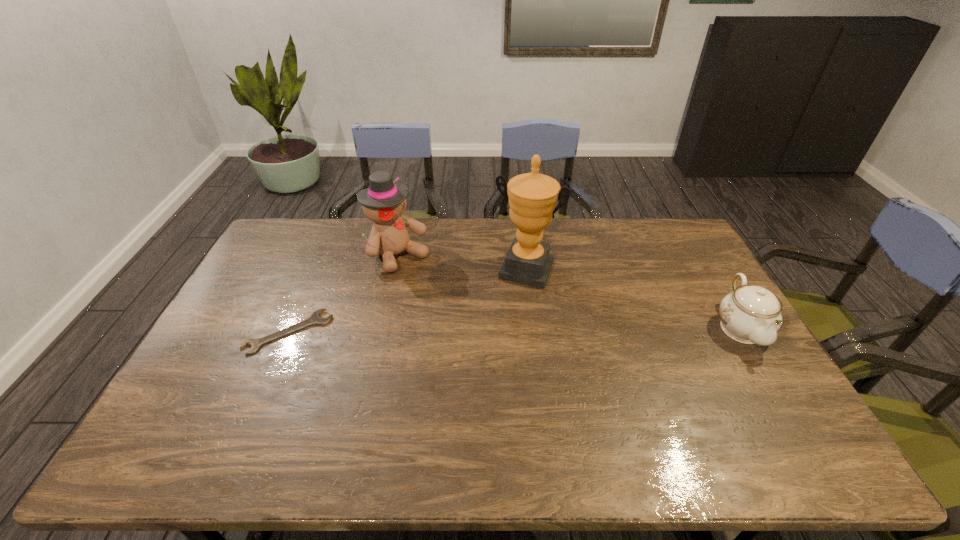
You are a GUI agent. You are given a task and a screenshot of the screen. Output one action in this format:
    pyautogui.click(x=<x>, y=<y>)
    Task: Click on the free area in between the wrench and the award
    This screenshot has height=540, width=960.
    Given the screenshot: What is the action you would take?
    pyautogui.click(x=407, y=301)

Identify the location of free point between the award and the wrench. Image resolution: width=960 pixels, height=540 pixels. (407, 301).

At what (x,y) coordinates should I click in order to perform the action: click on unoccupied position between the award and the chinaware. Please return your answer as a coordinate pair (x, y). The height and width of the screenshot is (540, 960). Looking at the image, I should click on (633, 299).

Find the location of a particular element. empty space between the second shortest object and the award is located at coordinates (633, 299).

Where is `empty location between the tallest object and the second tallest object`? empty location between the tallest object and the second tallest object is located at coordinates (462, 262).

Locate an element on the screen. object that is the nearest to the tallest object is located at coordinates (384, 202).

Find the location of a particular element. The width and height of the screenshot is (960, 540). object that is the closest to the third tallest object is located at coordinates (532, 197).